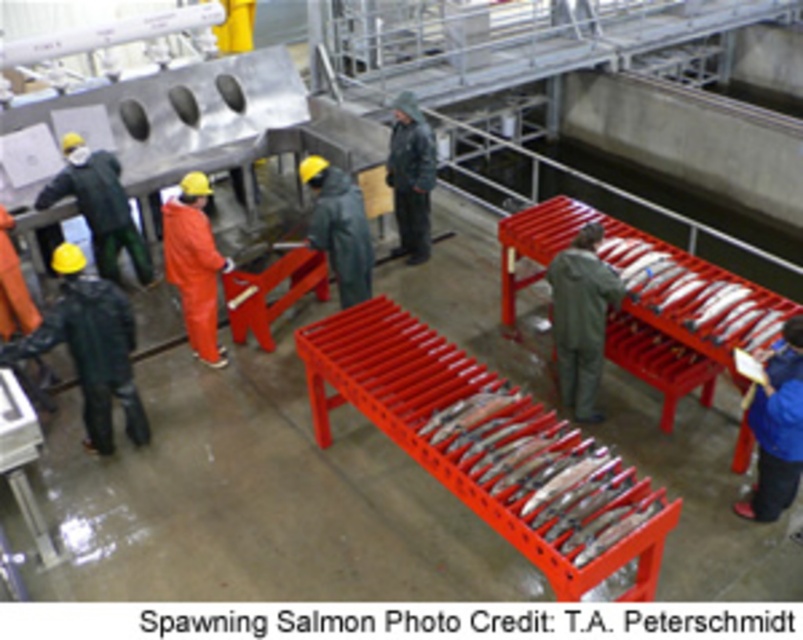
You are a worker in the fish processing facility and need to know if the shiny silver fish at center right can fit into a container that is the same width as the dark gray waterproof jacket at center. Can it fit?

The shiny silver fish at center right is wider than the dark gray waterproof jacket at center, so it cannot fit into a container of that width.

You are an inspector in the facility and need to determine if the black rubber boots at lower left can be fully submerged in a 1.2 meter deep cleaning pool. The matte black jacket at left is hanging nearby. Can the boots be submerged without the jacket getting wet?

The black rubber boots at lower left has a greater height compared to matte black jacket at left. Since the boots are taller than the jacket, submerging them in the 1.2 meter pool would require the jacket to be placed higher or moved away to avoid getting wet.